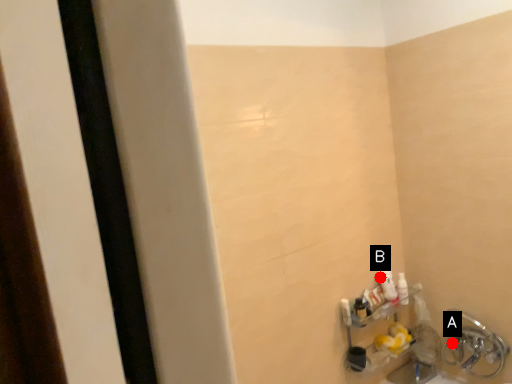
Question: Two points are circled on the image, labeled by A and B beside each circle. Which point is farther to the camera?

Choices:
 (A) A is further
 (B) B is further

Answer: (B)